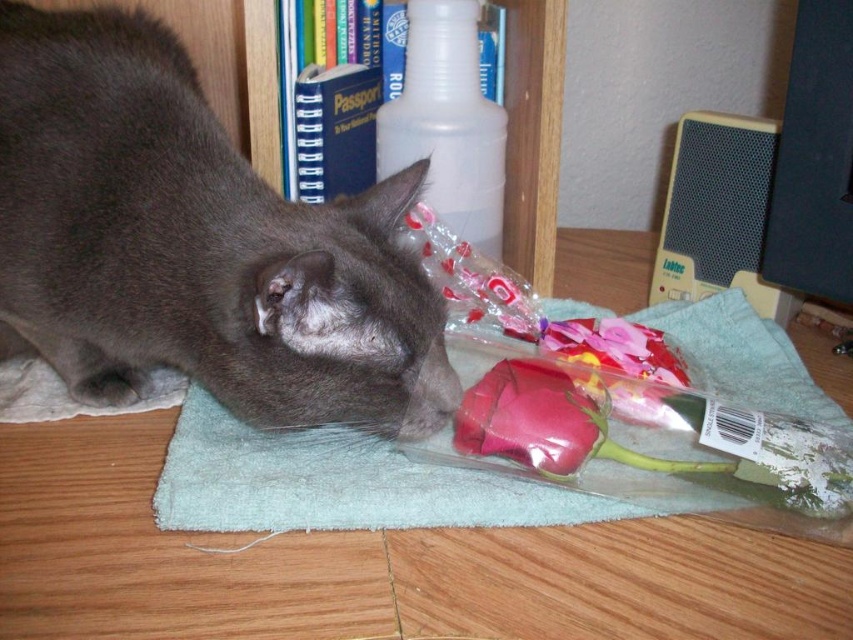
Question: Which of the following is the farthest from the observer?

Choices:
 (A) translucent plastic rose at lower center
 (B) gray fur cat at center
 (C) wooden bookshelf at upper center
 (D) matte pink rose at lower center

Answer: (C)

Question: Is teal towel at lower center below translucent plastic rose at lower center?

Choices:
 (A) no
 (B) yes

Answer: (B)

Question: Can you confirm if gray fur cat at center is bigger than matte pink rose at lower center?

Choices:
 (A) yes
 (B) no

Answer: (A)

Question: Does wooden bookshelf at upper center have a lesser width compared to matte pink rose at lower center?

Choices:
 (A) yes
 (B) no

Answer: (A)

Question: Which point is closer to the camera?

Choices:
 (A) (628, 362)
 (B) (294, 332)

Answer: (B)

Question: Which of the following is the farthest from the observer?

Choices:
 (A) (653, 358)
 (B) (442, 193)
 (C) (561, 392)
 (D) (258, 518)

Answer: (B)